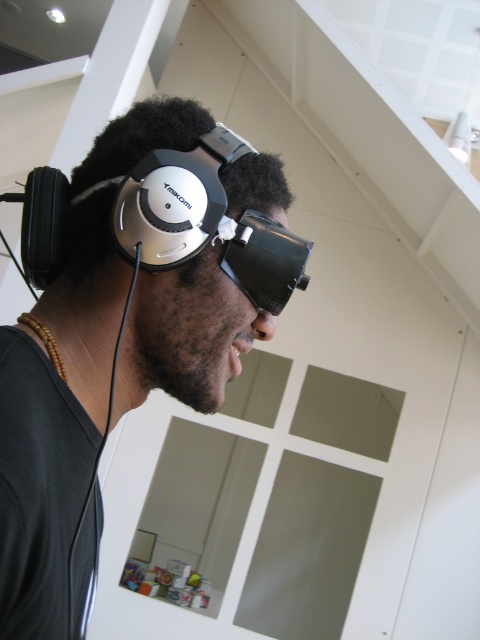
Question: Among these objects, which one is nearest to the camera?

Choices:
 (A) matte black headphones at left
 (B) black matte/glossy vr goggles at center

Answer: (A)

Question: Can you confirm if matte black headphones at left is positioned above black matte/glossy vr goggles at center?

Choices:
 (A) yes
 (B) no

Answer: (B)

Question: Does matte black headphones at left have a lesser width compared to black matte/glossy vr goggles at center?

Choices:
 (A) no
 (B) yes

Answer: (A)

Question: Considering the relative positions of matte black headphones at left and black matte/glossy vr goggles at center in the image provided, where is matte black headphones at left located with respect to black matte/glossy vr goggles at center?

Choices:
 (A) left
 (B) right

Answer: (A)